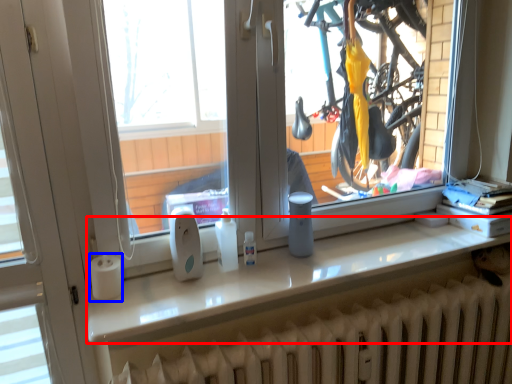
Question: Which point is closer to the camera, counter top (highlighted by a red box) or paper towel (highlighted by a blue box)?

Choices:
 (A) counter top
 (B) paper towel

Answer: (A)